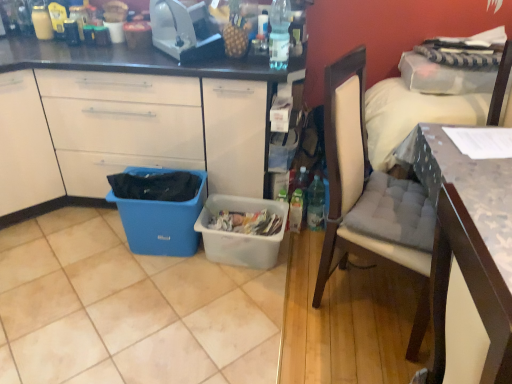
Question: Would you consider clear plastic bottle at upper center to be distant from white fabric pillow at upper right?

Choices:
 (A) no
 (B) yes

Answer: (A)

Question: Can you confirm if clear plastic bottle at upper center is smaller than white fabric pillow at upper right?

Choices:
 (A) yes
 (B) no

Answer: (A)

Question: Considering the relative sizes of clear plastic bottle at upper center and white fabric pillow at upper right in the image provided, is clear plastic bottle at upper center bigger than white fabric pillow at upper right?

Choices:
 (A) no
 (B) yes

Answer: (A)

Question: Can we say clear plastic bottle at upper center lies outside white fabric pillow at upper right?

Choices:
 (A) no
 (B) yes

Answer: (B)

Question: Does clear plastic bottle at upper center have a greater height compared to white fabric pillow at upper right?

Choices:
 (A) yes
 (B) no

Answer: (A)

Question: From the image's perspective, is blue plastic trash can at lower left positioned above or below translucent plastic picnic basket at center?

Choices:
 (A) below
 (B) above

Answer: (B)

Question: Would you say blue plastic trash can at lower left is inside or outside translucent plastic picnic basket at center?

Choices:
 (A) outside
 (B) inside

Answer: (A)

Question: From their relative heights in the image, would you say blue plastic trash can at lower left is taller or shorter than translucent plastic picnic basket at center?

Choices:
 (A) tall
 (B) short

Answer: (A)

Question: From a real-world perspective, relative to translucent plastic picnic basket at center, is blue plastic trash can at lower left vertically above or below?

Choices:
 (A) above
 (B) below

Answer: (A)

Question: Considering the positions of blue plastic trash can at lower left and clear plastic bottle at upper center in the image, is blue plastic trash can at lower left bigger or smaller than clear plastic bottle at upper center?

Choices:
 (A) small
 (B) big

Answer: (B)

Question: Is blue plastic trash can at lower left in front of or behind clear plastic bottle at upper center in the image?

Choices:
 (A) front
 (B) behind

Answer: (B)

Question: From a real-world perspective, relative to clear plastic bottle at upper center, is blue plastic trash can at lower left vertically above or below?

Choices:
 (A) above
 (B) below

Answer: (B)

Question: Looking at their shapes, would you say blue plastic trash can at lower left is wider or thinner than clear plastic bottle at upper center?

Choices:
 (A) thin
 (B) wide

Answer: (B)

Question: From the image's perspective, is white plastic toaster at upper center above or below blue plastic bin at lower left?

Choices:
 (A) above
 (B) below

Answer: (A)

Question: In terms of size, does white plastic toaster at upper center appear bigger or smaller than blue plastic bin at lower left?

Choices:
 (A) small
 (B) big

Answer: (B)